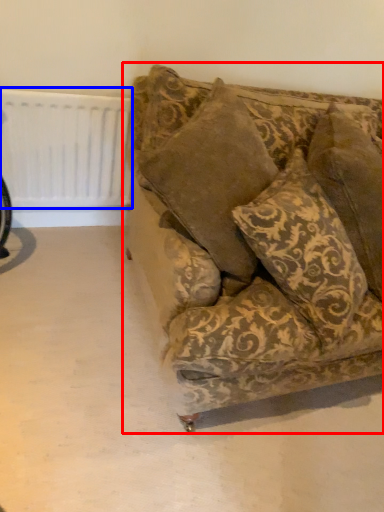
Question: Which object appears closest to the camera in this image, studio couch (highlighted by a red box) or radiator (highlighted by a blue box)?

Choices:
 (A) studio couch
 (B) radiator

Answer: (A)